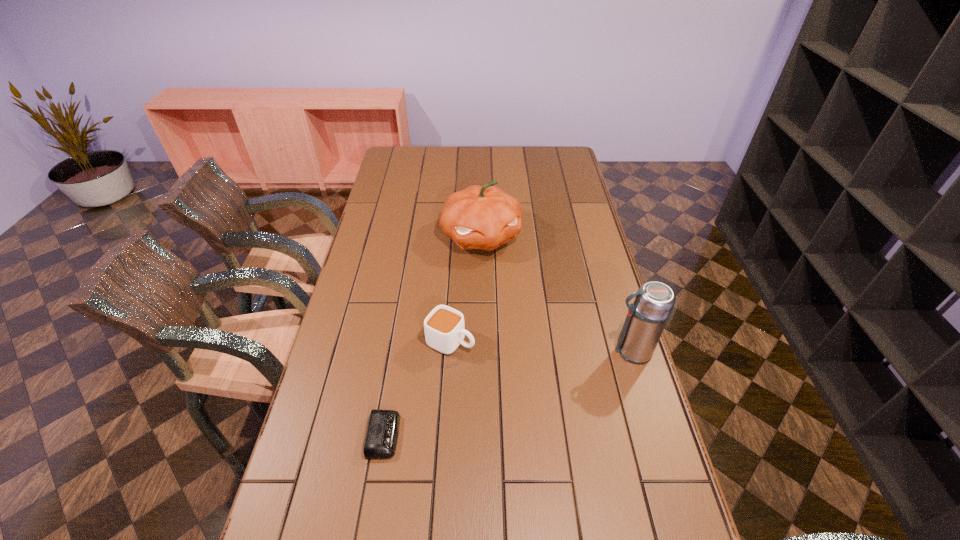
This screenshot has height=540, width=960. What are the coordinates of `the nearest object` in the screenshot? It's located at (382, 433).

This screenshot has width=960, height=540. What are the coordinates of `the leftmost object` in the screenshot? It's located at (382, 433).

Locate an element on the screen. This screenshot has height=540, width=960. the rightmost object is located at coordinates (646, 319).

Identify the location of pumpkin. The width and height of the screenshot is (960, 540). (485, 217).

Find the location of a particular element. The width and height of the screenshot is (960, 540). cup is located at coordinates (444, 328).

In order to click on free spot located 0.160m on the display of the shortest object in this screenshot , I will do `click(462, 435)`.

You are a GUI agent. You are given a task and a screenshot of the screen. Output one action in this format:
    pyautogui.click(x=<x>, y=<y>)
    Task: Click on the vacant space located 0.280m with a handle on the side of the rightmost object
    
    Given the screenshot: What is the action you would take?
    pyautogui.click(x=516, y=351)

The height and width of the screenshot is (540, 960). I want to click on vacant space located with a handle on the side of the rightmost object, so click(x=492, y=351).

I want to click on vacant space located 0.310m with a handle on the side of the rightmost object, so click(x=505, y=351).

I want to click on free space located on the front face of the pumpkin, so click(529, 341).